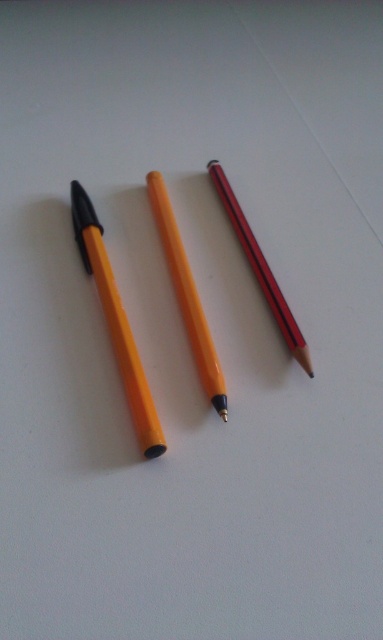
Image resolution: width=383 pixels, height=640 pixels. What do you see at coordinates (116, 323) in the screenshot? I see `matte orange pen at left` at bounding box center [116, 323].

Can you confirm if matte orange pen at left is thinner than matte orange pencil at center?

In fact, matte orange pen at left might be wider than matte orange pencil at center.

Is point (119, 353) behind point (198, 371)?

No, (119, 353) is closer to viewer.

I want to click on matte orange pen at left, so click(116, 323).

Consider the image. Is matte orange pen at left behind matte red pencil at center?

No, it is not.

Does matte orange pen at left have a lesser width compared to matte red pencil at center?

In fact, matte orange pen at left might be wider than matte red pencil at center.

Who is more distant from viewer, (75, 200) or (212, 179)?

The point (212, 179) is behind.

Where is `matte orange pen at left`? The image size is (383, 640). matte orange pen at left is located at coordinates (116, 323).

Between matte orange pencil at center and matte red pencil at center, which one appears on the left side from the viewer's perspective?

Positioned to the left is matte orange pencil at center.

Between point (181, 243) and point (232, 204), which one is positioned in front?

Point (181, 243) is in front.

Is point (204, 358) closer to camera compared to point (220, 188)?

Yes.

The image size is (383, 640). What are the coordinates of `matte orange pencil at center` in the screenshot? It's located at (186, 296).